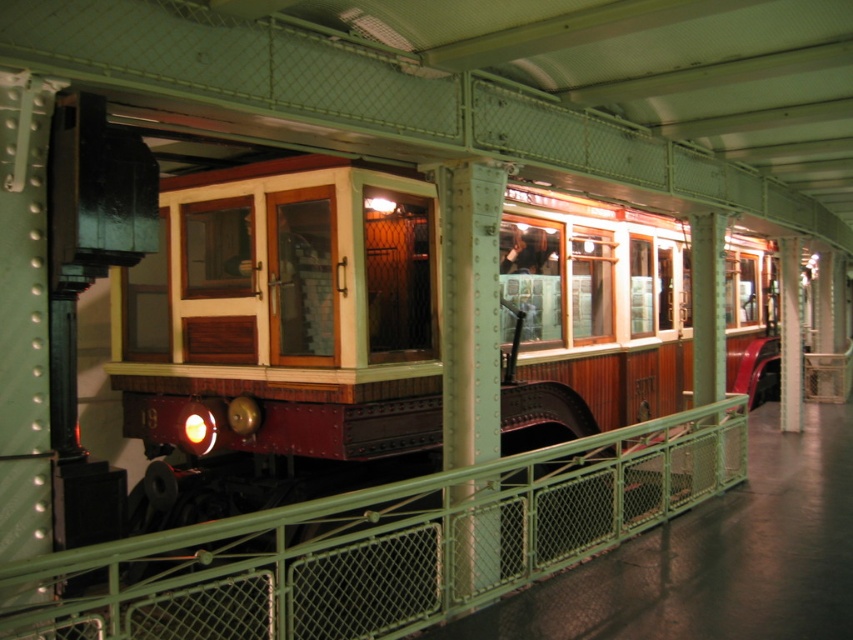
Between wooden paneling train at center and green metal fence at center, which one has less height?

With less height is wooden paneling train at center.

Is point (418, 298) positioned after point (386, 628)?

Yes, it is.

You are a GUI agent. You are given a task and a screenshot of the screen. Output one action in this format:
    pyautogui.click(x=<x>, y=<y>)
    Task: Click on the wooden paneling train at center
    Image resolution: width=853 pixels, height=640 pixels.
    Given the screenshot: What is the action you would take?
    coord(285,314)